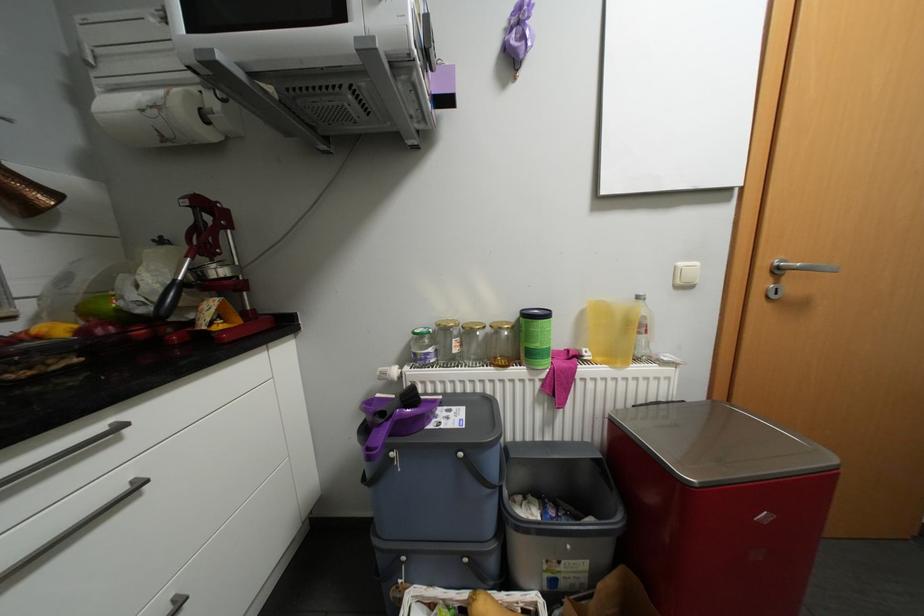
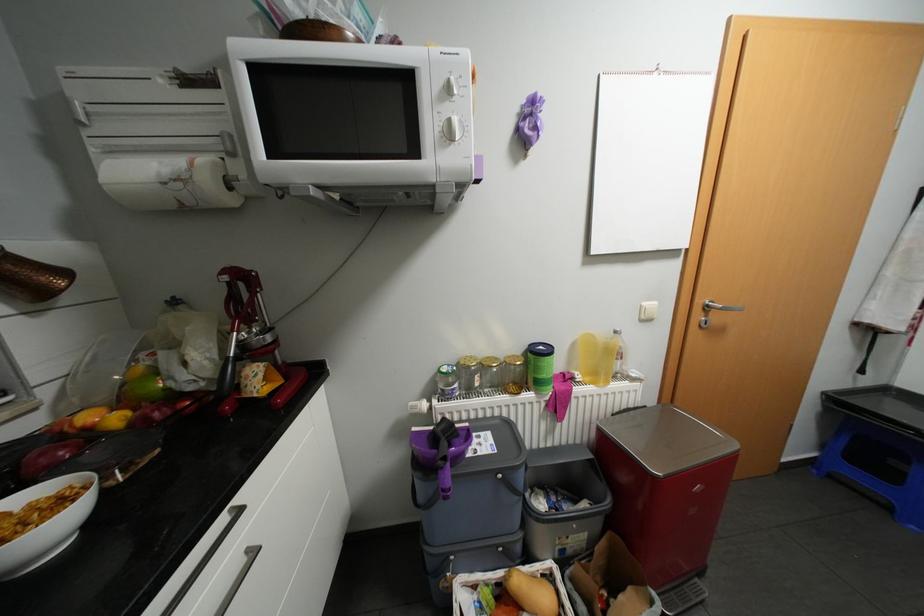
Find the pixel in the second image that matches point (594, 354) in the first image.

(587, 377)